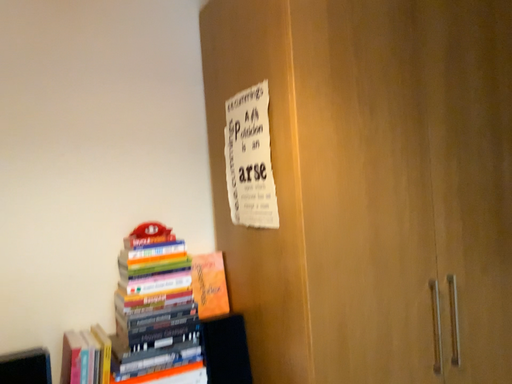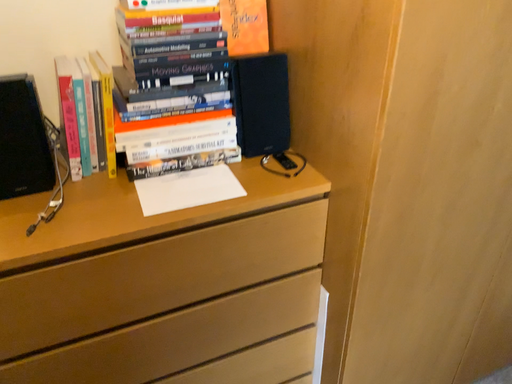
Question: Which way did the camera rotate in the video?

Choices:
 (A) rotated upward
 (B) rotated downward

Answer: (B)